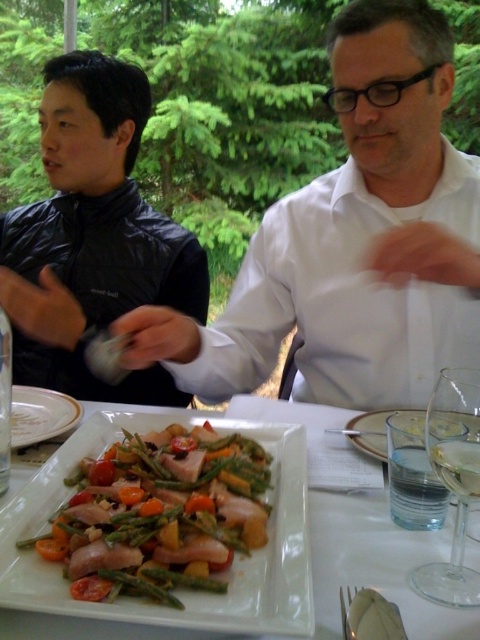
Question: Is white glossy shirt at upper center wider than white glossy plate at center?

Choices:
 (A) no
 (B) yes

Answer: (B)

Question: Is white glossy plate at center thinner than white porcelain plate at lower left?

Choices:
 (A) no
 (B) yes

Answer: (A)

Question: Does white glossy shirt at upper center appear on the right side of white porcelain plate at lower left?

Choices:
 (A) yes
 (B) no

Answer: (A)

Question: Which is nearer to the shiny green asparagus at center?

Choices:
 (A) black leather jacket at left
 (B) transparent glass wine glass at lower right
 (C) white porcelain plate at lower left
 (D) clear glass plate at center

Answer: (C)

Question: Which point is farther to the camera?

Choices:
 (A) shiny green asparagus at center
 (B) white glossy shirt at upper center
 (C) clear glass plate at center

Answer: (B)

Question: Which of the following is the farthest from the observer?

Choices:
 (A) (348, 422)
 (B) (17, 433)
 (C) (216, 452)
 (D) (468, 385)

Answer: (A)